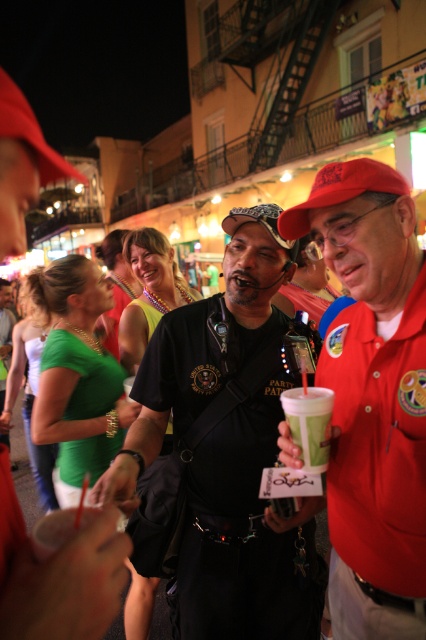
You are at a party and want to find the person wearing the black matte shirt at center. Which direction should you look relative to the red matte baseball cap at center?

The black matte shirt at center is to the left of the red matte baseball cap at center, so you should look to the left of the red matte baseball cap at center to find the person wearing the black matte shirt at center.